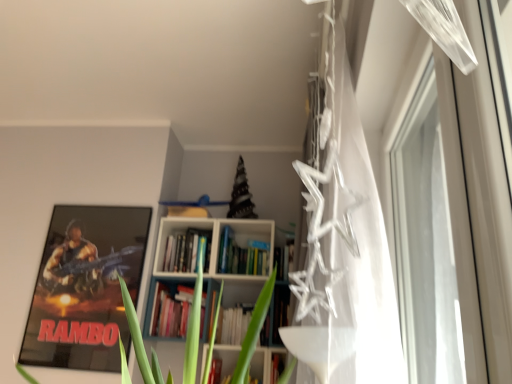
In order to face hardcover books at center, should I rotate leftwards or rightwards?

To align with it, rotate left about 8.664°.

Measure the distance between hardcover books at center and camera.

hardcover books at center and camera are 2.56 meters apart.

The height and width of the screenshot is (384, 512). In order to click on transparent plastic stars at upper right in this screenshot , I will do `click(348, 237)`.

Is transparent plastic stars at upper right facing towards metallic rambo poster at left?

No, transparent plastic stars at upper right does not turn towards metallic rambo poster at left.

From a real-world perspective, is transparent plastic stars at upper right physically below metallic rambo poster at left?

No, from a real-world perspective, transparent plastic stars at upper right is not under metallic rambo poster at left.

In terms of height, does transparent plastic stars at upper right look taller or shorter compared to metallic rambo poster at left?

Clearly, transparent plastic stars at upper right is taller compared to metallic rambo poster at left.

Is the position of transparent plastic stars at upper right more distant than that of metallic rambo poster at left?

No, the depth of transparent plastic stars at upper right is less than that of metallic rambo poster at left.

How distant is metallic rambo poster at left from hardcover books at center?

A distance of 17.27 inches exists between metallic rambo poster at left and hardcover books at center.

Considering the sizes of metallic rambo poster at left and hardcover books at center in the image, is metallic rambo poster at left bigger or smaller than hardcover books at center?

In the image, metallic rambo poster at left appears to be larger than hardcover books at center.

Relative to hardcover books at center, is metallic rambo poster at left in front or behind?

metallic rambo poster at left is in front of hardcover books at center.

From the image's perspective, is metallic rambo poster at left located above hardcover books at center?

No, from the image's perspective, metallic rambo poster at left is not over hardcover books at center.

In terms of width, does hardcover books at center look wider or thinner when compared to metallic rambo poster at left?

hardcover books at center is wider than metallic rambo poster at left.

Considering the sizes of objects hardcover books at center and metallic rambo poster at left in the image provided, who is taller, hardcover books at center or metallic rambo poster at left?

With more height is metallic rambo poster at left.

Looking at this image, is hardcover books at center touching metallic rambo poster at left?

No, hardcover books at center is not next to metallic rambo poster at left.

Does hardcover books at center have a smaller size compared to metallic rambo poster at left?

Yes.

Looking at this image, from the image's perspective, which object appears higher, transparent glass window at upper right or metallic rambo poster at left?

transparent glass window at upper right appears higher in the image.

Who is bigger, transparent glass window at upper right or metallic rambo poster at left?

transparent glass window at upper right is bigger.

Can you confirm if transparent glass window at upper right is thinner than metallic rambo poster at left?

Correct, the width of transparent glass window at upper right is less than that of metallic rambo poster at left.

Based on the photo, is transparent plastic stars at upper right positioned far away from transparent glass window at upper right?

No, transparent plastic stars at upper right is not far away from transparent glass window at upper right.

Find the location of a particular element. curtain on the left of transparent glass window at upper right is located at coordinates (348, 237).

Who is shorter, transparent plastic stars at upper right or transparent glass window at upper right?

transparent glass window at upper right is shorter.

From a real-world perspective, which is physically below, transparent plastic stars at upper right or transparent glass window at upper right?

transparent glass window at upper right is physically lower.

Does hardcover books at center have a larger size compared to transparent glass window at upper right?

No, hardcover books at center is not bigger than transparent glass window at upper right.

Does point (197, 253) appear closer or farther from the camera than point (401, 220)?

Point (197, 253) is farther from the camera than point (401, 220).

From the image's perspective, is hardcover books at center on transparent glass window at upper right?

Actually, hardcover books at center appears below transparent glass window at upper right in the image.

Between hardcover books at center and transparent glass window at upper right, which one appears on the left side from the viewer's perspective?

hardcover books at center is more to the left.

Are metallic rambo poster at left and transparent plastic stars at upper right beside each other?

No.

Is the depth of metallic rambo poster at left greater than that of transparent plastic stars at upper right?

Yes, it is behind transparent plastic stars at upper right.

Identify the location of curtain above the metallic rambo poster at left (from a real-world perspective). Image resolution: width=512 pixels, height=384 pixels. (348, 237).

How different are the orientations of metallic rambo poster at left and transparent plastic stars at upper right in degrees?

The angle between the facing direction of metallic rambo poster at left and the facing direction of transparent plastic stars at upper right is 86.3 degrees.

In the image, there is a metallic rambo poster at left. Where is `curtain above it (from the image's perspective)`? The height and width of the screenshot is (384, 512). curtain above it (from the image's perspective) is located at coordinates (348, 237).

Identify the location of picture frame on the left of hardcover books at center. (85, 287).

From the image, which object appears to be farther from transparent plastic stars at upper right, metallic rambo poster at left or transparent glass window at upper right?

→ metallic rambo poster at left is positioned further to the anchor transparent plastic stars at upper right.

From the picture: Estimate the real-world distances between objects in this image. Which object is closer to transparent plastic stars at upper right, transparent glass window at upper right or metallic rambo poster at left?

Among the two, transparent glass window at upper right is located nearer to transparent plastic stars at upper right.

Based on their spatial positions, is transparent glass window at upper right or metallic rambo poster at left further from hardcover books at center?

The object further to hardcover books at center is transparent glass window at upper right.

Which object lies nearer to the anchor point transparent glass window at upper right, metallic rambo poster at left or hardcover books at center?

Based on the image, hardcover books at center appears to be nearer to transparent glass window at upper right.

Looking at the image, which one is located closer to transparent glass window at upper right, hardcover books at center or transparent plastic stars at upper right?

transparent plastic stars at upper right is closer to transparent glass window at upper right.

Which object lies nearer to the anchor point transparent plastic stars at upper right, transparent glass window at upper right or hardcover books at center?

transparent glass window at upper right is closer to transparent plastic stars at upper right.

Considering their positions, is hardcover books at center positioned closer to transparent plastic stars at upper right than transparent glass window at upper right?

Based on the image, transparent glass window at upper right appears to be nearer to transparent plastic stars at upper right.

From the image, which object appears to be nearer to hardcover books at center, metallic rambo poster at left or transparent plastic stars at upper right?

metallic rambo poster at left is positioned closer to the anchor hardcover books at center.

This screenshot has height=384, width=512. I want to click on picture frame between transparent plastic stars at upper right and hardcover books at center along the z-axis, so click(85, 287).

Locate an element on the screen. Image resolution: width=512 pixels, height=384 pixels. curtain between transparent glass window at upper right and hardcover books at center along the z-axis is located at coordinates pyautogui.click(x=348, y=237).

Where is `picture frame positioned between transparent glass window at upper right and hardcover books at center from near to far`? This screenshot has width=512, height=384. picture frame positioned between transparent glass window at upper right and hardcover books at center from near to far is located at coordinates (85, 287).

The height and width of the screenshot is (384, 512). Identify the location of curtain between transparent glass window at upper right and metallic rambo poster at left in the front-back direction. (348, 237).